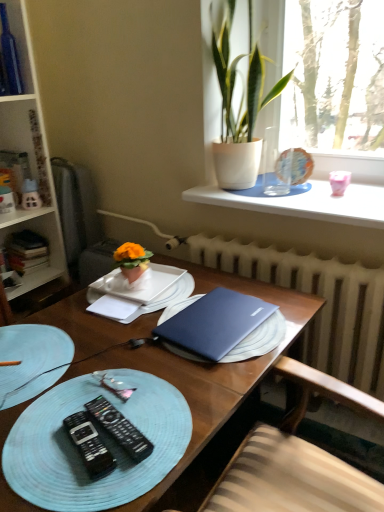
This screenshot has width=384, height=512. I want to click on free space in front of black plastic remote control at lower left, acting as the second remote control starting from the right, so click(x=76, y=489).